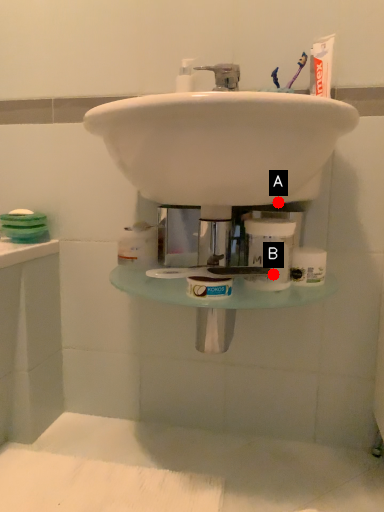
Question: Two points are circled on the image, labeled by A and B beside each circle. Which point is closer to the camera?

Choices:
 (A) A is closer
 (B) B is closer

Answer: (B)